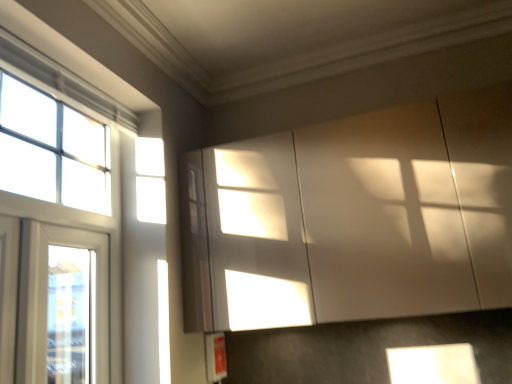
Question: Can you confirm if white glass window at left, which ranks as the 2th window in bottom-to-top order, is positioned to the left of white glass window at left, the 3th window when ordered from top to bottom?

Choices:
 (A) yes
 (B) no

Answer: (A)

Question: Can you confirm if white glass window at left, which ranks as the 2th window in bottom-to-top order, is taller than white glass window at left, the 3th window when ordered from top to bottom?

Choices:
 (A) no
 (B) yes

Answer: (B)

Question: Is white glass window at left, placed as the 2th window when sorted from top to bottom, positioned before white glass window at left, acting as the first window starting from the bottom?

Choices:
 (A) yes
 (B) no

Answer: (A)

Question: From a real-world perspective, is white glass window at left, which ranks as the 2th window in bottom-to-top order, over white glass window at left, the 3th window when ordered from top to bottom?

Choices:
 (A) no
 (B) yes

Answer: (B)

Question: From the image's perspective, does white glass window at left, which ranks as the 2th window in bottom-to-top order, appear lower than white glass window at left, the 3th window when ordered from top to bottom?

Choices:
 (A) no
 (B) yes

Answer: (A)

Question: Would you say white glass window at left, which ranks as the 2th window in bottom-to-top order, is inside or outside white glass window at left, the 3th window when ordered from top to bottom?

Choices:
 (A) inside
 (B) outside

Answer: (B)

Question: From a real-world perspective, is white glass window at left, placed as the 2th window when sorted from top to bottom, positioned above or below white glass window at left, the 3th window when ordered from top to bottom?

Choices:
 (A) above
 (B) below

Answer: (A)

Question: From the image's perspective, is white glass window at left, which ranks as the 2th window in bottom-to-top order, positioned above or below white glass window at left, acting as the first window starting from the bottom?

Choices:
 (A) above
 (B) below

Answer: (A)

Question: Is white glass window at left, which ranks as the 2th window in bottom-to-top order, to the left or to the right of white glass window at left, the 3th window when ordered from top to bottom, in the image?

Choices:
 (A) left
 (B) right

Answer: (A)

Question: Considering the positions of white glass window at left, the 3th window when ordered from top to bottom, and clear glass window at upper left, which appears as the 1th window when viewed from the top, in the image, is white glass window at left, the 3th window when ordered from top to bottom, taller or shorter than clear glass window at upper left, which appears as the 1th window when viewed from the top,?

Choices:
 (A) short
 (B) tall

Answer: (B)

Question: From a real-world perspective, is white glass window at left, the 3th window when ordered from top to bottom, positioned above or below clear glass window at upper left, which appears as the 1th window when viewed from the top?

Choices:
 (A) above
 (B) below

Answer: (B)

Question: From the image's perspective, relative to clear glass window at upper left, which appears as the 1th window when viewed from the top, is white glass window at left, acting as the first window starting from the bottom, above or below?

Choices:
 (A) below
 (B) above

Answer: (A)

Question: Visually, is white glass window at left, acting as the first window starting from the bottom, positioned to the left or to the right of clear glass window at upper left, which appears as the 1th window when viewed from the top?

Choices:
 (A) left
 (B) right

Answer: (B)

Question: In the image, is clear glass window at upper left, which appears as the 1th window when viewed from the top, positioned in front of or behind white glass window at left, the 3th window when ordered from top to bottom?

Choices:
 (A) front
 (B) behind

Answer: (A)

Question: From a real-world perspective, is clear glass window at upper left, placed as the third window when sorted from bottom to top, above or below white glass window at left, acting as the first window starting from the bottom?

Choices:
 (A) above
 (B) below

Answer: (A)